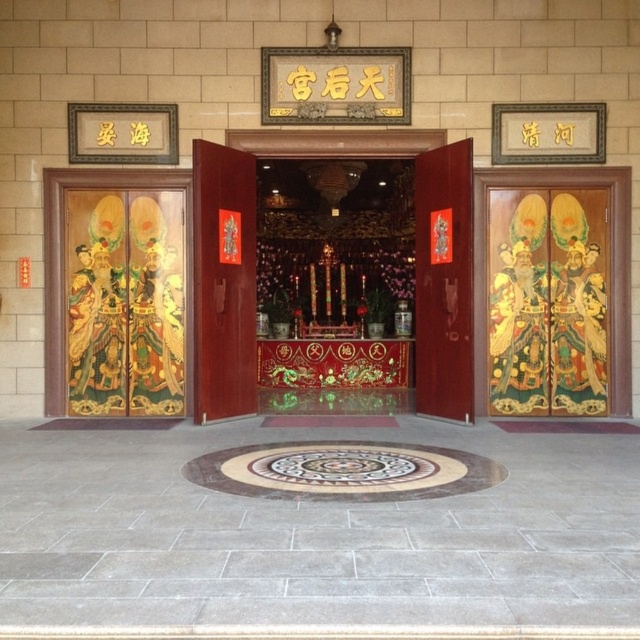
You are standing at the entrance of the temple and see two points marked on the wall. The first point is at coordinates point (244, 134) and the second is at point (436, 289). Which point is closer to you?

Point (244, 134) is further to the viewer than point (436, 289), so the second point is closer to you.

You are standing at the entrance of the temple and need to locate the main entrance doors. According to the scene, which direction should you move to reach the polished wood doors at center from the matte wooden door at center?

The polished wood doors at center are to the right of the matte wooden door at center, so you should move to the right to reach them.